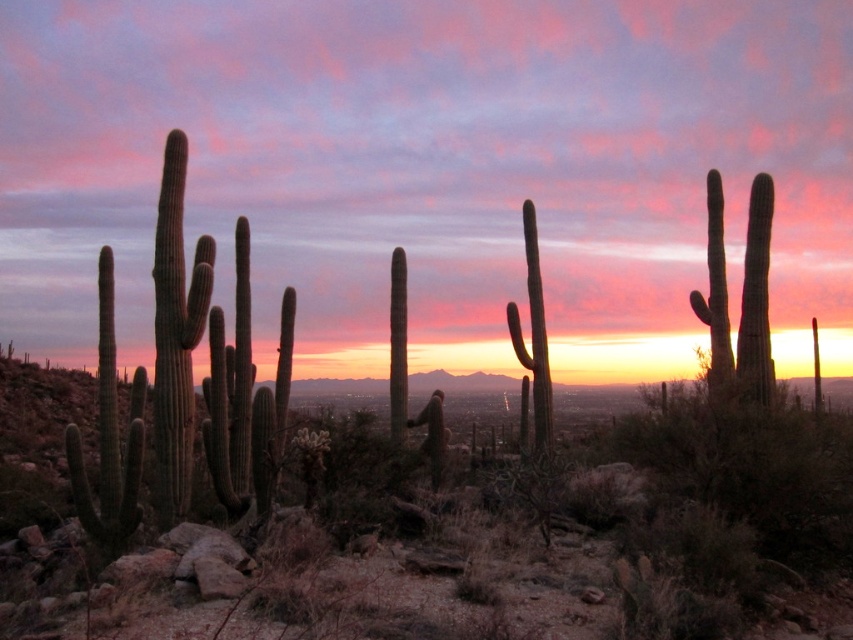
Can you confirm if green spiny cactus at left is taller than green spiny cactus at center?

Yes.

Does green spiny cactus at left appear on the left side of green spiny cactus at center?

Indeed, green spiny cactus at left is positioned on the left side of green spiny cactus at center.

Is point (247, 356) less distant than point (532, 289)?

Yes.

Identify the location of green spiny cactus at left. This screenshot has height=640, width=853. (212, 365).